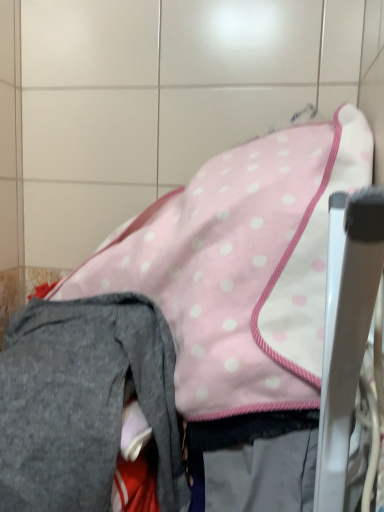
What do you see at coordinates (84, 402) in the screenshot? I see `gray fleece pants at lower left` at bounding box center [84, 402].

You are a GUI agent. You are given a task and a screenshot of the screen. Output one action in this format:
    pyautogui.click(x=<x>, y=<y>)
    Task: Click on the gray fleece pants at lower left
    The width and height of the screenshot is (384, 512).
    Given the screenshot: What is the action you would take?
    pyautogui.click(x=84, y=402)

Between metallic silver chair at right and gray fleece pants at lower left, which one has smaller size?

metallic silver chair at right.

Is metallic silver chair at right not close to gray fleece pants at lower left?

That's not correct — metallic silver chair at right is a little close to gray fleece pants at lower left.

At what (x,y) coordinates should I click in order to perform the action: click on chair on the right of gray fleece pants at lower left. Please return your answer as a coordinate pair (x, y). Looking at the image, I should click on (346, 330).

Between point (341, 254) and point (62, 508), which one is positioned in front?

Positioned in front is point (341, 254).

From the image's perspective, is gray fleece pants at lower left positioned above or below pink polka dot fabric at center?

From the image's perspective, gray fleece pants at lower left appears below pink polka dot fabric at center.

Can you tell me how much gray fleece pants at lower left and pink polka dot fabric at center differ in facing direction?

gray fleece pants at lower left and pink polka dot fabric at center are facing 0.000358 degrees away from each other.

Is point (91, 448) in front of point (313, 173)?

That is True.

From a real-world perspective, is gray fleece pants at lower left under pink polka dot fabric at center?

Yes, from a real-world perspective, gray fleece pants at lower left is beneath pink polka dot fabric at center.

What's the angular difference between pink polka dot fabric at center and gray fleece pants at lower left's facing directions?

There is a 0.000358-degree angle between the facing directions of pink polka dot fabric at center and gray fleece pants at lower left.

In the image, is pink polka dot fabric at center positioned in front of or behind gray fleece pants at lower left?

In the image, pink polka dot fabric at center appears behind gray fleece pants at lower left.

Between pink polka dot fabric at center and gray fleece pants at lower left, which one has larger size?

pink polka dot fabric at center.

Which of these two, metallic silver chair at right or pink polka dot fabric at center, is smaller?

metallic silver chair at right is smaller.

From the image's perspective, which object appears higher, metallic silver chair at right or pink polka dot fabric at center?

From the image's view, pink polka dot fabric at center is above.

Looking at this image, is metallic silver chair at right to the right of pink polka dot fabric at center from the viewer's perspective?

Yes.

Are metallic silver chair at right and pink polka dot fabric at center making contact?

No, metallic silver chair at right is not with pink polka dot fabric at center.

Is pink polka dot fabric at center at the right side of metallic silver chair at right?

Incorrect, pink polka dot fabric at center is not on the right side of metallic silver chair at right.

Is pink polka dot fabric at center inside the boundaries of metallic silver chair at right, or outside?

pink polka dot fabric at center is not inside metallic silver chair at right, it's outside.

From a real-world perspective, who is located lower, pink polka dot fabric at center or metallic silver chair at right?

metallic silver chair at right.

Is gray fleece pants at lower left spatially inside metallic silver chair at right, or outside of it?

gray fleece pants at lower left is not enclosed by metallic silver chair at right.

Is there a large distance between gray fleece pants at lower left and metallic silver chair at right?

No, gray fleece pants at lower left is in close proximity to metallic silver chair at right.

Considering the sizes of objects gray fleece pants at lower left and metallic silver chair at right in the image provided, who is taller, gray fleece pants at lower left or metallic silver chair at right?

gray fleece pants at lower left is taller.

Does gray fleece pants at lower left have a larger size compared to metallic silver chair at right?

Correct, gray fleece pants at lower left is larger in size than metallic silver chair at right.

Locate an element on the screen. This screenshot has width=384, height=512. trousers on the left side of metallic silver chair at right is located at coordinates coord(84,402).

The width and height of the screenshot is (384, 512). I want to click on trousers below the pink polka dot fabric at center (from a real-world perspective), so click(84, 402).

From the picture: Which object lies nearer to the anchor point pink polka dot fabric at center, gray fleece pants at lower left or metallic silver chair at right?

Among the two, gray fleece pants at lower left is located nearer to pink polka dot fabric at center.

Estimate the real-world distances between objects in this image. Which object is closer to gray fleece pants at lower left, pink polka dot fabric at center or metallic silver chair at right?

pink polka dot fabric at center is positioned closer to the anchor gray fleece pants at lower left.

Which object lies nearer to the anchor point pink polka dot fabric at center, metallic silver chair at right or gray fleece pants at lower left?

gray fleece pants at lower left is positioned closer to the anchor pink polka dot fabric at center.

Considering their positions, is metallic silver chair at right positioned further to gray fleece pants at lower left than pink polka dot fabric at center?

Among the two, metallic silver chair at right is located further to gray fleece pants at lower left.

From the image, which object appears to be farther from metallic silver chair at right, gray fleece pants at lower left or pink polka dot fabric at center?

gray fleece pants at lower left is further to metallic silver chair at right.

When comparing their distances from metallic silver chair at right, does pink polka dot fabric at center or gray fleece pants at lower left seem further?

The object further to metallic silver chair at right is gray fleece pants at lower left.

Where is `wide located between gray fleece pants at lower left and metallic silver chair at right in the left-right direction`? This screenshot has height=512, width=384. wide located between gray fleece pants at lower left and metallic silver chair at right in the left-right direction is located at coordinates (242, 268).